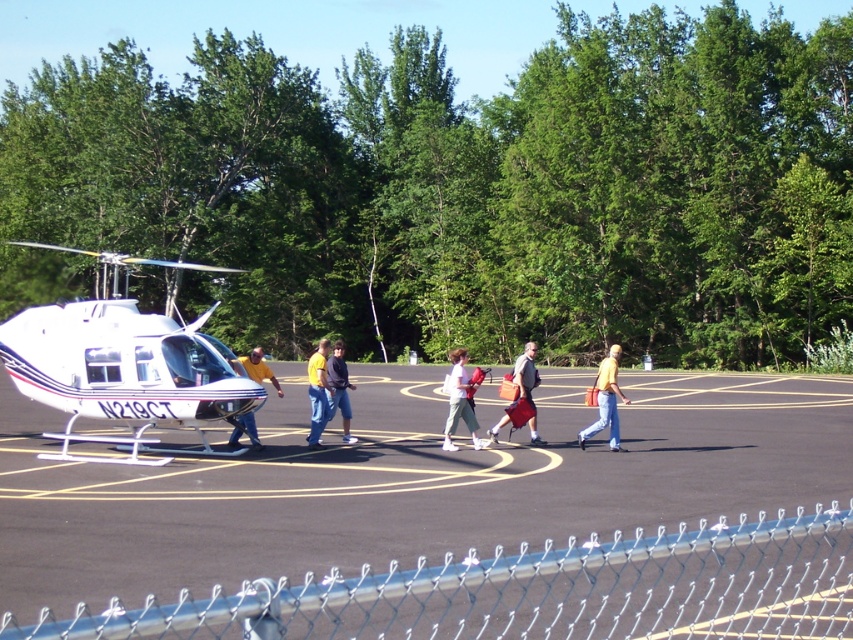
You are a photographer standing near the gray fabric backpack at center and the yellow shirt at center. You want to take a photo that includes both items but emphasizes the larger one. Which object should you focus on to ensure it stands out more in the picture?

The gray fabric backpack at center has a larger size compared to the yellow shirt at center, so focusing on the gray fabric backpack at center will make it stand out more in the photo.

You are a photographer standing behind the gray fabric backpack at center and the yellow shirt at center. You want to take a photo of the helicopter without any obstructions. Which object should you move to ensure the helicopter is fully visible?

The gray fabric backpack at center is positioned over yellow shirt at center, so moving the gray fabric backpack at center would allow the helicopter to be seen without obstruction.

You are standing at the fence and want to take a photo of the white glossy helicopter at left and the yellow matte shirt at center. Which object should you focus on first to ensure both are in the frame?

The white glossy helicopter at left is closer to the viewer than the yellow matte shirt at center, so you should focus on the white glossy helicopter at left first to ensure both are in the frame.